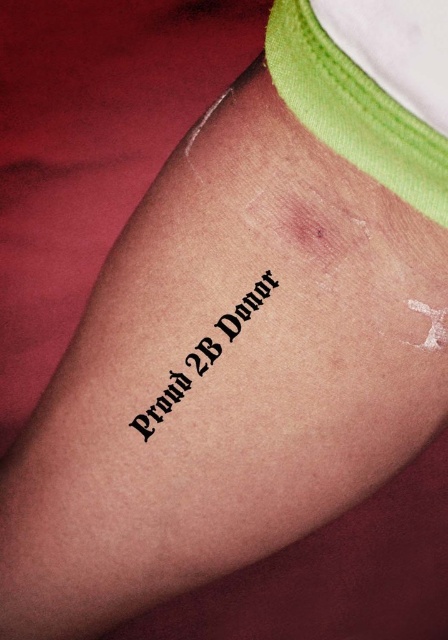
You are a healthcare professional preparing to administer an injection. You need to avoid the black ink text at center and the white fabric at upper right. Given that the minimum safe distance required between the injection site and any existing marks is 6 inches, can you inject between these two objects?

The white fabric at upper right and black ink text at center are 5.86 inches apart, which is less than the required 6 inches. Therefore, you cannot inject between them as it does not meet the safety distance requirement.

You are examining the forearm shown in the image and need to determine the order of proximity from your viewpoint. Which of the two points, point [365,3] or point [160,404], is closer to you?

Point [365,3] is closer to the viewer than point [160,404].

You are a healthcare professional examining a patient. You notice the white fabric at upper right and the black ink text at center on their forearm. Which object is closer to your viewpoint?

The white fabric at upper right is in front of the black ink text at center, so it is closer to your viewpoint.